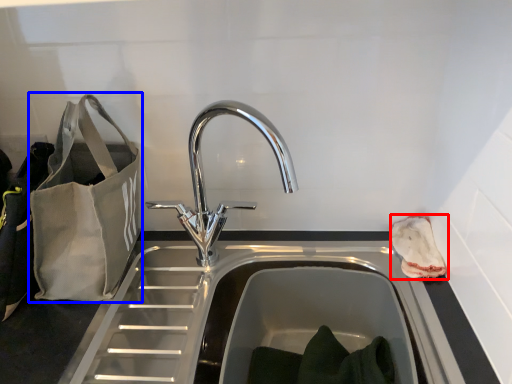
Question: Among these objects, which one is farthest to the camera, pouch (highlighted by a red box) or bag (highlighted by a blue box)?

Choices:
 (A) pouch
 (B) bag

Answer: (A)